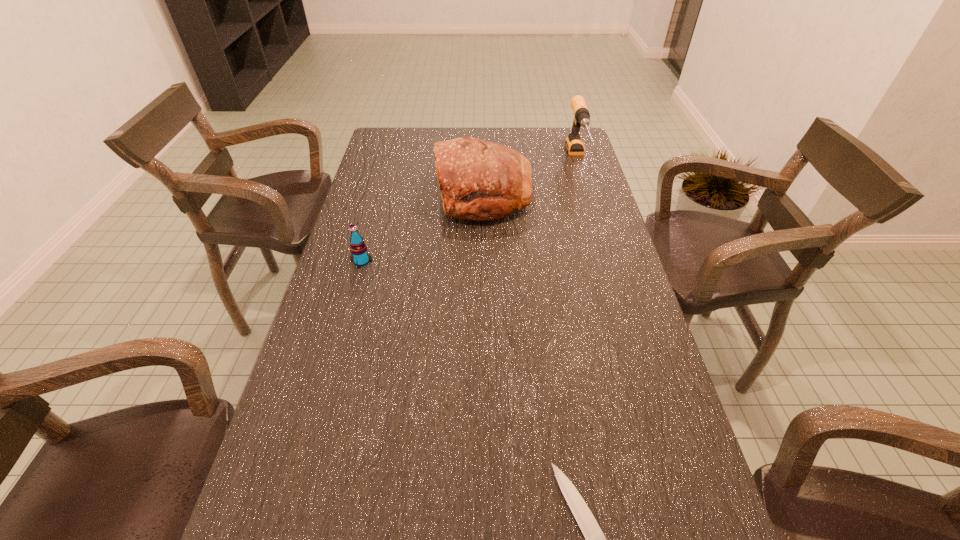
Where is `drill`? The height and width of the screenshot is (540, 960). drill is located at coordinates (574, 145).

You are a GUI agent. You are given a task and a screenshot of the screen. Output one action in this format:
    pyautogui.click(x=<x>, y=<y>)
    Task: Click on the bread
    
    Given the screenshot: What is the action you would take?
    pyautogui.click(x=479, y=180)

I want to click on the third tallest object, so click(x=359, y=256).

You are a GUI agent. You are given a task and a screenshot of the screen. Output one action in this format:
    pyautogui.click(x=<x>, y=<y>)
    Task: Click on the soda
    Image resolution: width=960 pixels, height=540 pixels.
    Given the screenshot: What is the action you would take?
    pyautogui.click(x=359, y=256)

Identify the location of vacant space located on the handle side of the rightmost object. The width and height of the screenshot is (960, 540). (604, 246).

Image resolution: width=960 pixels, height=540 pixels. In order to click on vacant position located at the sliced front of the bread in this screenshot , I will do `click(370, 194)`.

Locate an element on the screen. This screenshot has width=960, height=540. vacant space situated 0.080m at the sliced front of the bread is located at coordinates (412, 194).

At what (x,y) coordinates should I click in order to perform the action: click on free space located 0.080m at the sliced front of the bread. Please return your answer as a coordinate pair (x, y). The width and height of the screenshot is (960, 540). Looking at the image, I should click on (412, 194).

Where is `vacant point located on the back of the leftmost object`? vacant point located on the back of the leftmost object is located at coordinates (383, 184).

This screenshot has height=540, width=960. What are the coordinates of `object situated at the far edge` in the screenshot? It's located at (574, 145).